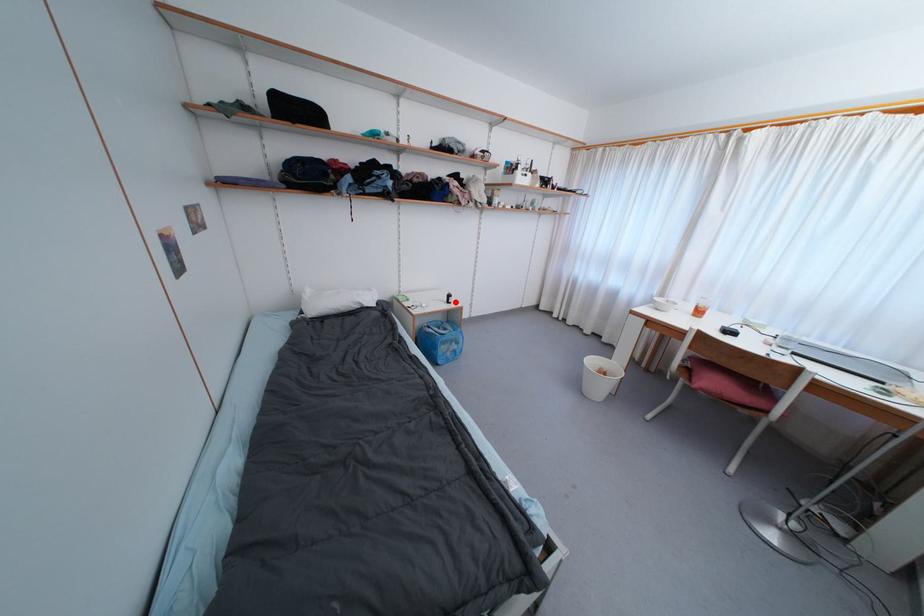
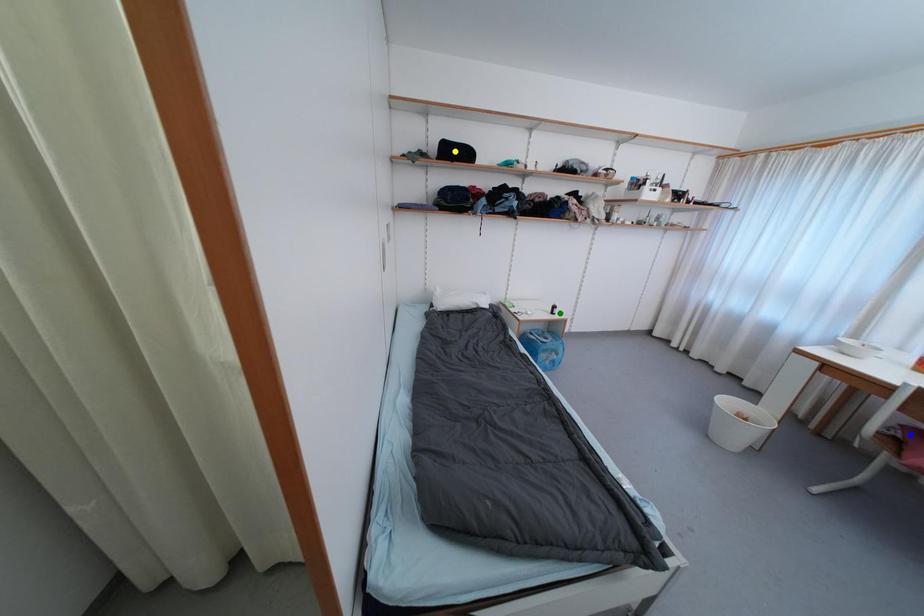
Question: I am providing you with two images of the same scene from different viewpoints. A red point is marked on the first image. You are given multiple points on the second image. Which point in image 2 represents the same 3d spot as the red point in image 1?

Choices:
 (A) yellow point
 (B) blue point
 (C) green point

Answer: (C)